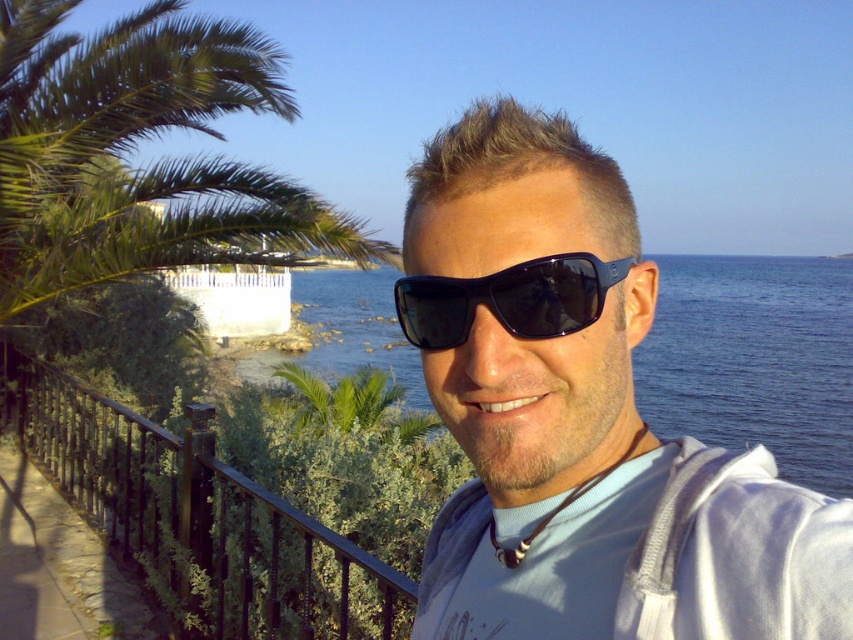
Question: Is matte black sunglasses at center in front of green leafy palm tree at upper left?

Choices:
 (A) yes
 (B) no

Answer: (A)

Question: Which object is closer to the camera taking this photo?

Choices:
 (A) black wrought iron railing at lower left
 (B) black plastic sunglasses at center

Answer: (B)

Question: Based on their relative distances, which object is farther from the black plastic sunglasses at center?

Choices:
 (A) matte black sunglasses at center
 (B) green leafy palm tree at upper left

Answer: (B)

Question: Which object is positioned farthest from the black plastic sunglasses at center?

Choices:
 (A) green leafy palm tree at upper left
 (B) matte black sunglasses at center

Answer: (A)

Question: Is matte black sunglasses at center bigger than black plastic sunglasses at center?

Choices:
 (A) yes
 (B) no

Answer: (A)

Question: Can you confirm if green leafy palm tree at upper left is positioned to the left of blue water at center?

Choices:
 (A) yes
 (B) no

Answer: (A)